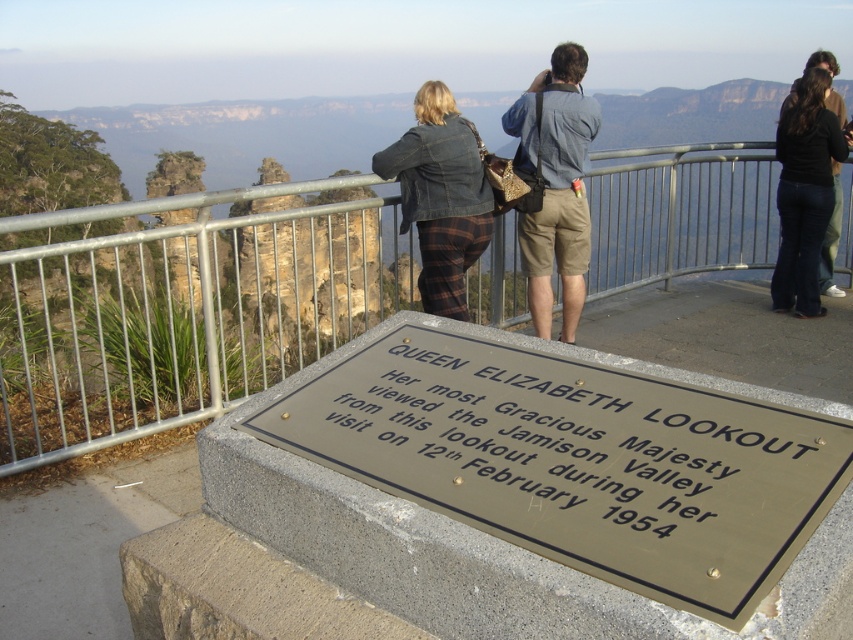
Question: Can you confirm if gold/grey stone plaque at center is bigger than silver metallic rail at center?

Choices:
 (A) no
 (B) yes

Answer: (A)

Question: Does silver metallic rail at center have a lesser width compared to black denim jeans at right?

Choices:
 (A) no
 (B) yes

Answer: (A)

Question: Which point is farther to the camera?

Choices:
 (A) gold/grey stone plaque at center
 (B) denim jacket at center
 (C) matte blue shirt at center

Answer: (C)

Question: Does matte blue shirt at center appear on the left side of black denim jeans at right?

Choices:
 (A) no
 (B) yes

Answer: (B)

Question: Which point is farther to the camera?

Choices:
 (A) (665, 573)
 (B) (807, 144)
 (C) (199, 352)
 (D) (582, 243)

Answer: (B)

Question: Considering the real-world distances, which object is closest to the black denim jeans at right?

Choices:
 (A) denim jacket at center
 (B) matte blue shirt at center
 (C) gold/grey stone plaque at center
 (D) silver metallic rail at center

Answer: (B)